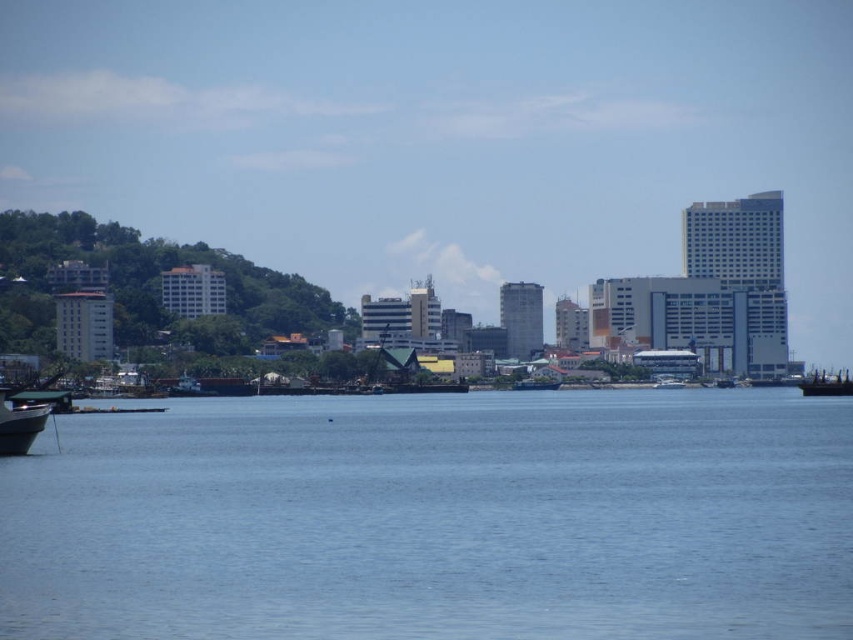
Is blue water at center to the right of metallic gray boat at lower left from the viewer's perspective?

Correct, you'll find blue water at center to the right of metallic gray boat at lower left.

Describe the element at coordinates (437, 518) in the screenshot. I see `blue water at center` at that location.

You are a GUI agent. You are given a task and a screenshot of the screen. Output one action in this format:
    pyautogui.click(x=<x>, y=<y>)
    Task: Click on the blue water at center
    This screenshot has width=853, height=640.
    Given the screenshot: What is the action you would take?
    pos(437,518)

At what (x,y) coordinates should I click in order to perform the action: click on blue water at center. Please return your answer as a coordinate pair (x, y). Looking at the image, I should click on (437, 518).

Can you confirm if blue water at center is thinner than metallic gray boat at center?

Incorrect, blue water at center's width is not less than metallic gray boat at center's.

Which of these two, blue water at center or metallic gray boat at center, stands taller?

Standing taller between the two is blue water at center.

Who is more distant from viewer, (541,532) or (550,380)?

The point (550,380) is more distant.

This screenshot has width=853, height=640. Identify the location of blue water at center. (437, 518).

Which is in front, point (4, 397) or point (808, 380)?

Point (4, 397)

Is metallic gray boat at lower left below metallic gray boat at right?

Correct, metallic gray boat at lower left is located below metallic gray boat at right.

Is point (24, 426) more distant than point (821, 396)?

No, (24, 426) is closer to viewer.

Locate an element on the screen. Image resolution: width=853 pixels, height=640 pixels. metallic gray boat at lower left is located at coordinates (19, 424).